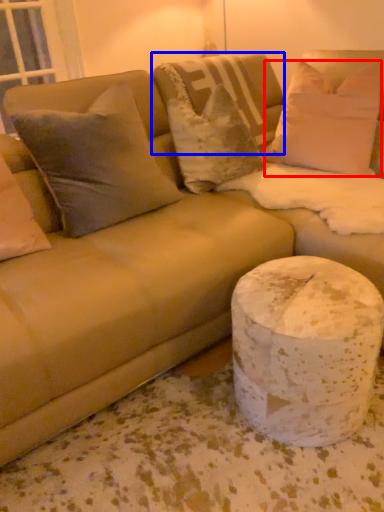
Question: Which of the following is the closest to the observer, pillow (highlighted by a red box) or pillow (highlighted by a blue box)?

Choices:
 (A) pillow
 (B) pillow

Answer: (A)